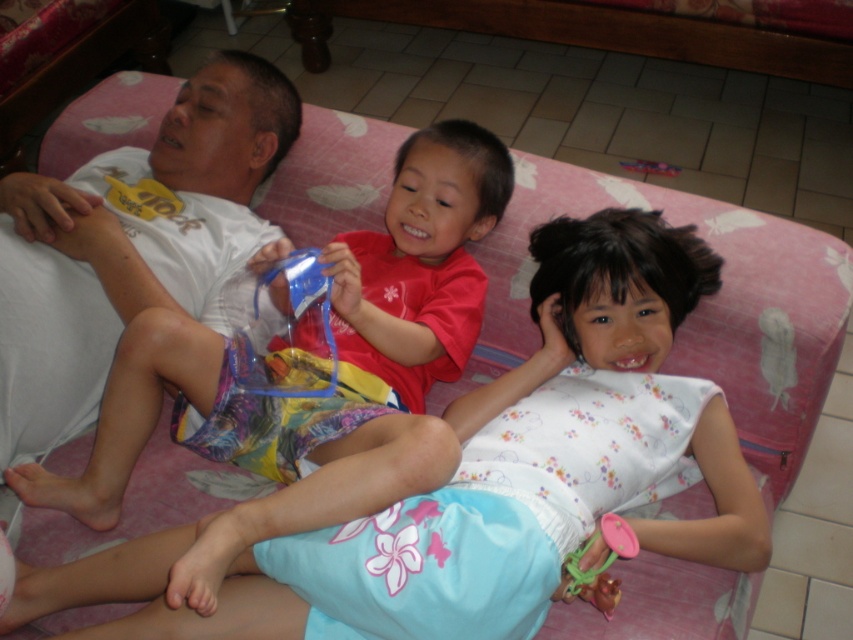
You are a photographer trying to capture a closeup of the red matte shirt at center and the pink plastic toy at lower right. Which object should you zoom in on first to ensure both are in focus?

The red matte shirt at center is bigger than the pink plastic toy at lower right, so you should focus on the red matte shirt at center first to ensure both are in focus.

You are a photographer trying to capture a candid shot of the two children in the scene. You notice their clothing items, the red matte shirt at center and the floral cotton dress at center. Which clothing item is positioned higher up in the image?

The red matte shirt at center is located above the floral cotton dress at center, so it is positioned higher up in the image.